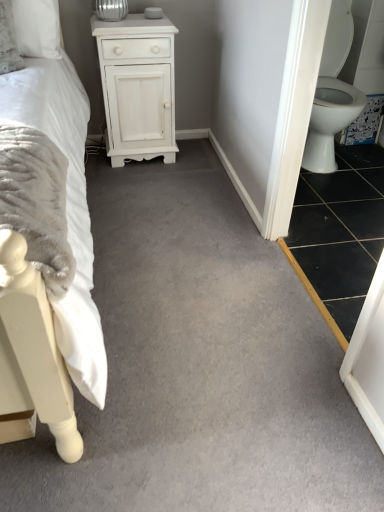
The width and height of the screenshot is (384, 512). Identify the location of free space above black tile at lower right (from a real-world perspective). (355, 209).